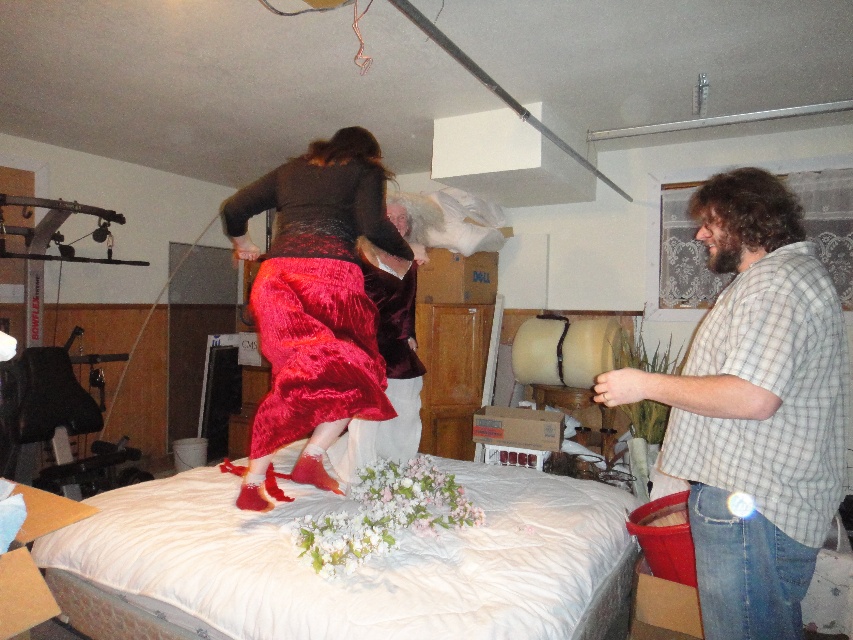
Question: Is white fabric bed at center wider than velvet red skirt at center?

Choices:
 (A) no
 (B) yes

Answer: (B)

Question: Is checkered shirt at right to the right of velvet red skirt at center from the viewer's perspective?

Choices:
 (A) no
 (B) yes

Answer: (B)

Question: Which of the following is the closest to the observer?

Choices:
 (A) white fabric bed at center
 (B) velvet red skirt at center

Answer: (A)

Question: Which point appears farthest from the camera in this image?

Choices:
 (A) (779, 579)
 (B) (184, 566)

Answer: (B)

Question: Which point is farther to the camera?

Choices:
 (A) velvet red skirt at center
 (B) white fabric bed at center
 (C) checkered shirt at right

Answer: (A)

Question: Does white fabric bed at center have a greater width compared to checkered shirt at right?

Choices:
 (A) no
 (B) yes

Answer: (B)